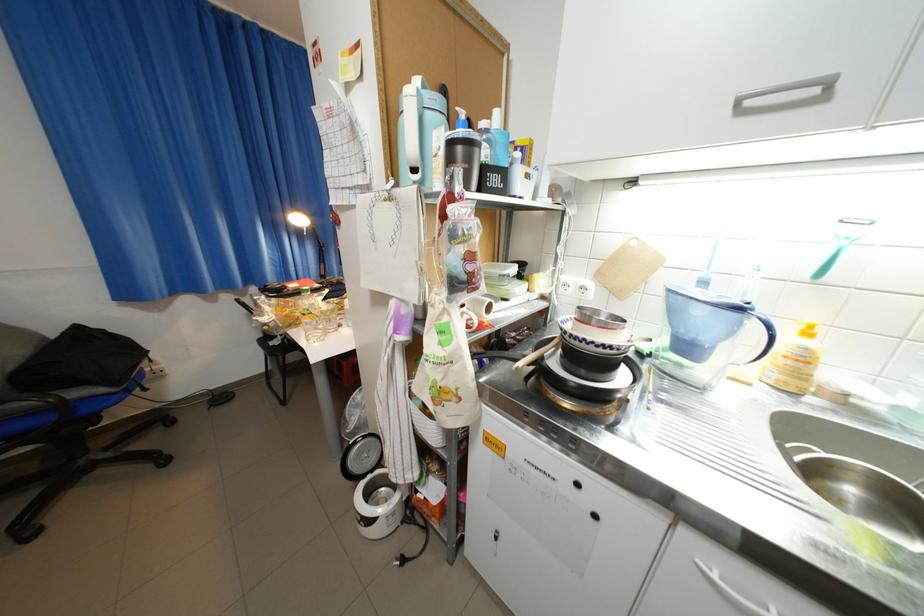
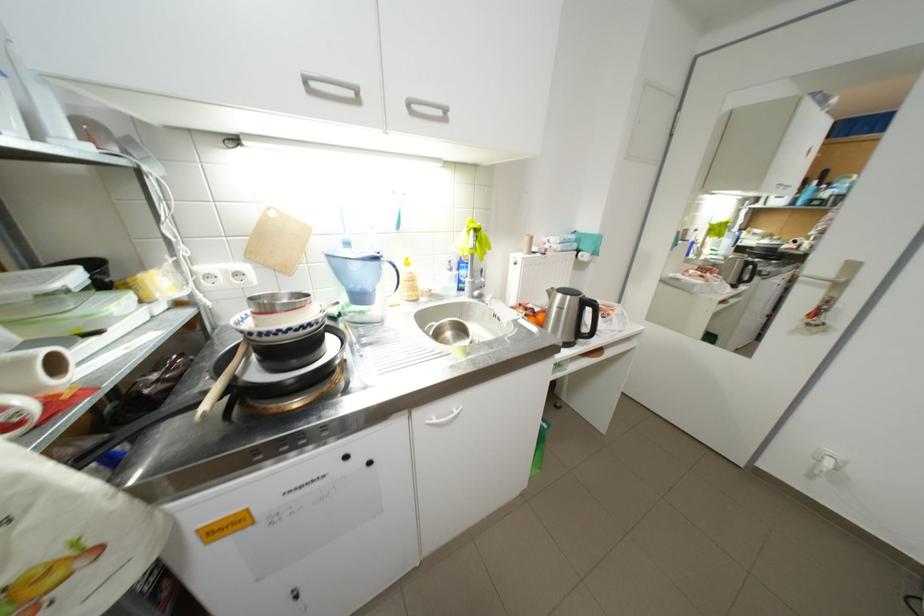
Locate, in the second image, the point that corresponds to the point at 537,358 in the first image.

(215, 394)